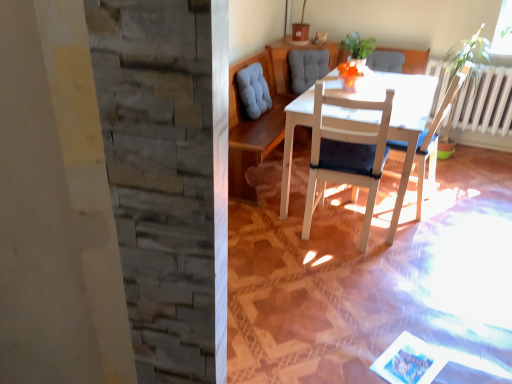
Locate an element on the screen. free space in front of white wood table at center is located at coordinates (378, 276).